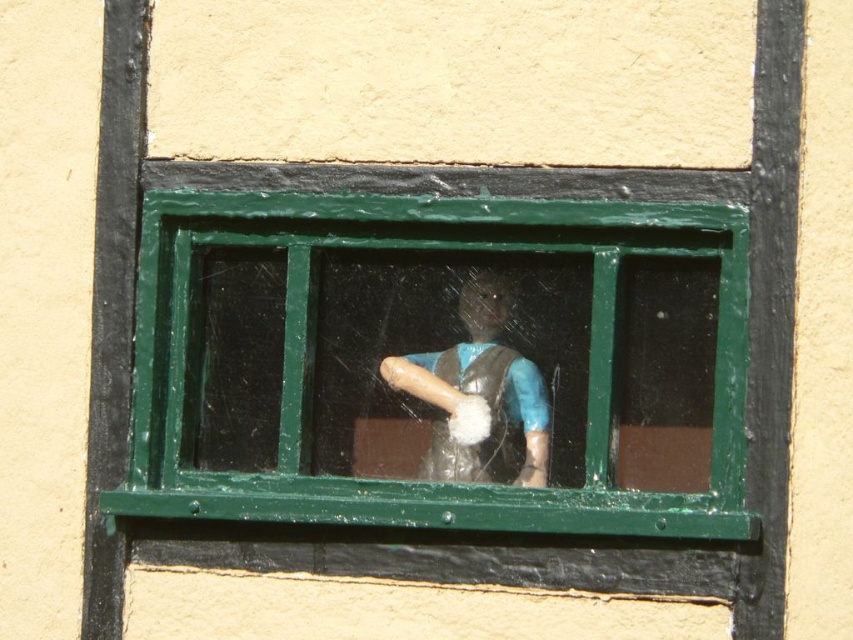
Question: Which of the following is the farthest from the observer?

Choices:
 (A) matte plastic figurine at center
 (B) wooden rolling pin at center
 (C) green painted wood window at center

Answer: (B)

Question: Is green painted wood window at center above wooden rolling pin at center?

Choices:
 (A) yes
 (B) no

Answer: (A)

Question: From the image, what is the correct spatial relationship of matte plastic figurine at center in relation to wooden rolling pin at center?

Choices:
 (A) left
 (B) right

Answer: (B)

Question: Among these points, which one is farthest from the camera?

Choices:
 (A) (596, 314)
 (B) (525, 360)

Answer: (B)

Question: Can you confirm if matte plastic figurine at center is positioned to the left of wooden rolling pin at center?

Choices:
 (A) yes
 (B) no

Answer: (B)

Question: Estimate the real-world distances between objects in this image. Which object is farther from the green painted wood window at center?

Choices:
 (A) wooden rolling pin at center
 (B) matte plastic figurine at center

Answer: (A)